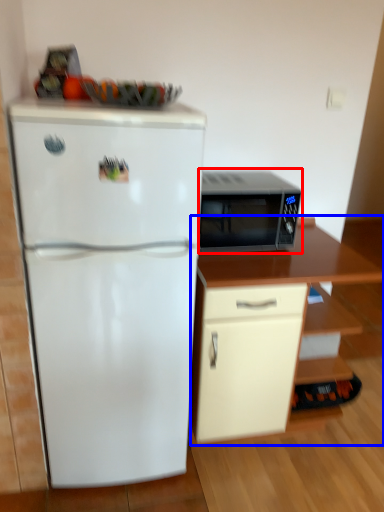
Question: Which object appears closest to the camera in this image, microwave oven (highlighted by a red box) or cabinetry (highlighted by a blue box)?

Choices:
 (A) microwave oven
 (B) cabinetry

Answer: (B)